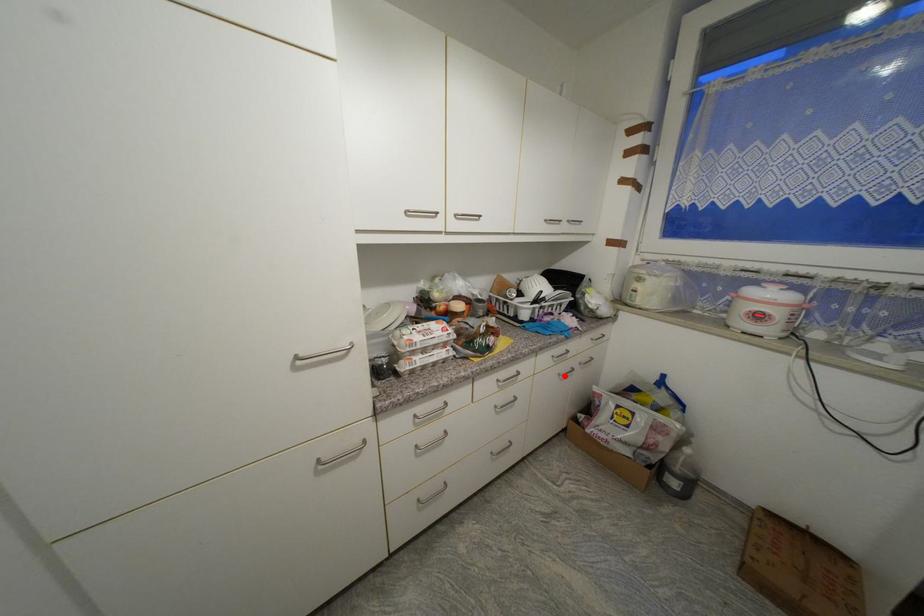
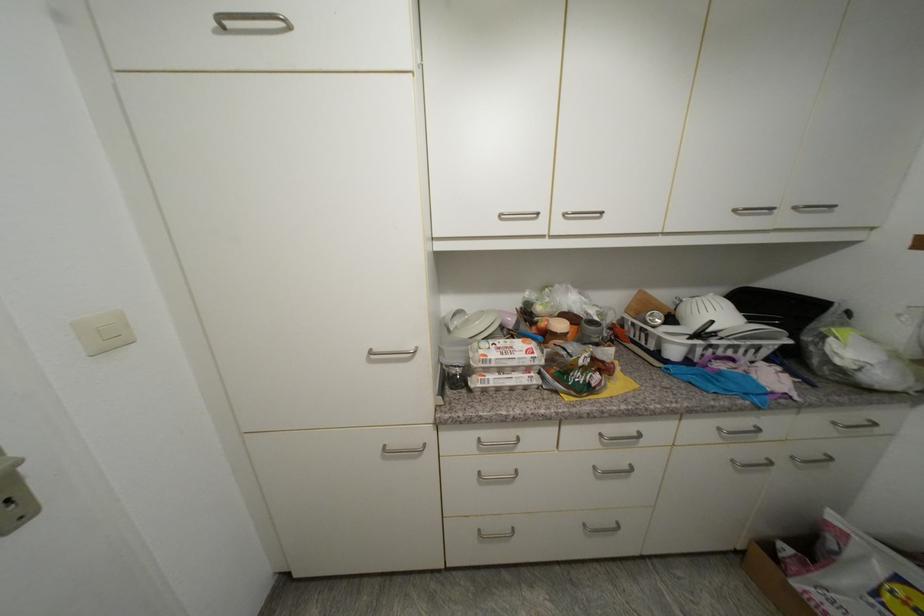
Find the pixel in the second image that matches the highlighted location in the first image.

(738, 463)